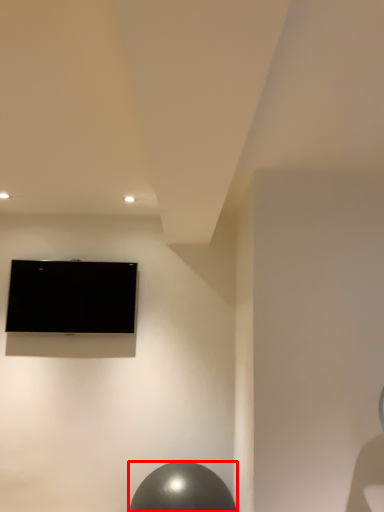
Question: Where is ball (annotated by the red box) located in relation to television in the image?

Choices:
 (A) right
 (B) left

Answer: (A)